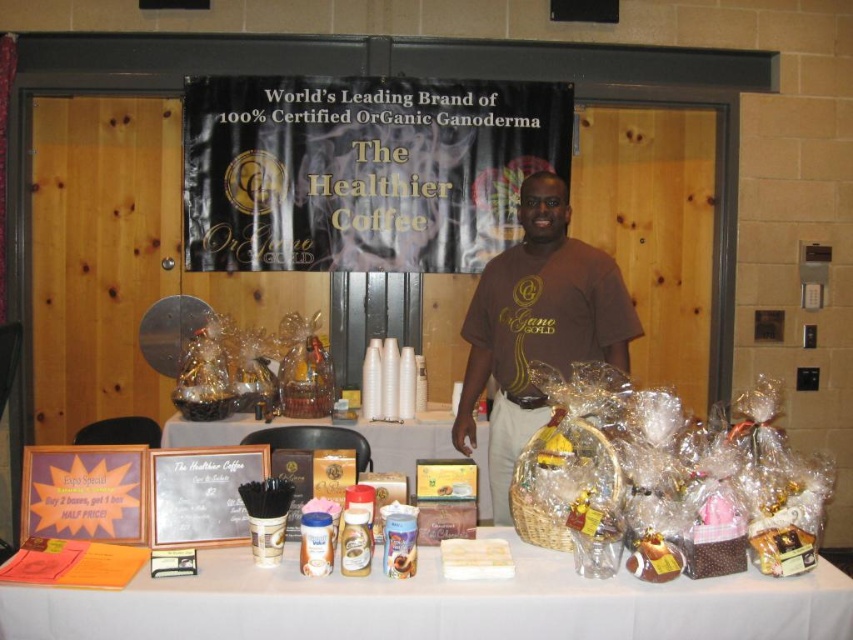
Is point (395, 211) behind point (486, 499)?

Yes, it is behind point (486, 499).

Is black fabric banner at upper center positioned at the back of wooden signboard at center?

Yes, it is behind wooden signboard at center.

Does point (543, 136) come in front of point (314, 420)?

No.

This screenshot has width=853, height=640. In order to click on black fabric banner at upper center in this screenshot , I will do `click(363, 170)`.

Does black wood frame at center appear on the right side of wooden signboard at center?

Incorrect, black wood frame at center is not on the right side of wooden signboard at center.

Can you confirm if black wood frame at center is positioned to the left of wooden signboard at center?

Yes, black wood frame at center is to the left of wooden signboard at center.

Identify the location of black wood frame at center. (201, 493).

Where is `black wood frame at center`? Image resolution: width=853 pixels, height=640 pixels. black wood frame at center is located at coordinates (201, 493).

Between black fabric banner at upper center and black wood frame at center, which one appears on the left side from the viewer's perspective?

black wood frame at center is more to the left.

Does black fabric banner at upper center have a smaller size compared to black wood frame at center?

Actually, black fabric banner at upper center might be larger than black wood frame at center.

Who is more forward, (508, 218) or (223, 497)?

Positioned in front is point (223, 497).

Locate an element on the screen. The width and height of the screenshot is (853, 640). black fabric banner at upper center is located at coordinates (363, 170).